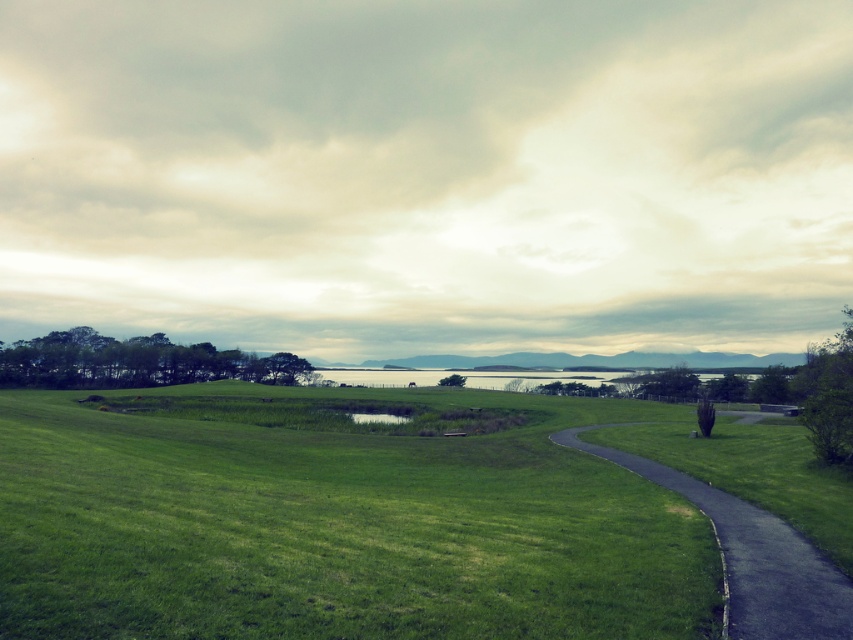
Question: Can you confirm if green grassy field at center is positioned to the left of dark gray asphalt path at lower right?

Choices:
 (A) yes
 (B) no

Answer: (A)

Question: Does green grassy field at center have a larger size compared to dark gray asphalt path at lower right?

Choices:
 (A) no
 (B) yes

Answer: (B)

Question: Among these objects, which one is farthest from the camera?

Choices:
 (A) dark gray asphalt path at lower right
 (B) green grassy field at center

Answer: (A)

Question: Which point is farther from the camera taking this photo?

Choices:
 (A) (312, 563)
 (B) (627, 461)

Answer: (B)

Question: Can you confirm if green grassy field at center is positioned to the left of dark gray asphalt path at lower right?

Choices:
 (A) yes
 (B) no

Answer: (A)

Question: Which point is closer to the camera?

Choices:
 (A) (724, 516)
 (B) (485, 429)

Answer: (A)